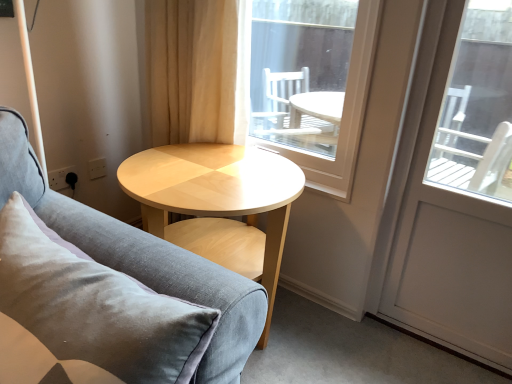
Question: Is beige fabric curtain at upper center shorter than transparent glass window at center?

Choices:
 (A) yes
 (B) no

Answer: (A)

Question: Is beige fabric curtain at upper center oriented away from transparent glass window at center?

Choices:
 (A) yes
 (B) no

Answer: (B)

Question: Can you confirm if beige fabric curtain at upper center is taller than transparent glass window at center?

Choices:
 (A) no
 (B) yes

Answer: (A)

Question: Are beige fabric curtain at upper center and transparent glass window at center making contact?

Choices:
 (A) no
 (B) yes

Answer: (A)

Question: Is beige fabric curtain at upper center smaller than transparent glass window at center?

Choices:
 (A) yes
 (B) no

Answer: (B)

Question: In the image, is beige fabric curtain at upper center on the left side or the right side of transparent glass window at center?

Choices:
 (A) right
 (B) left

Answer: (B)

Question: Considering their positions, is beige fabric curtain at upper center located in front of or behind transparent glass window at center?

Choices:
 (A) behind
 (B) front

Answer: (A)

Question: From their relative heights in the image, would you say beige fabric curtain at upper center is taller or shorter than transparent glass window at center?

Choices:
 (A) short
 (B) tall

Answer: (A)

Question: Considering the positions of point (182, 11) and point (301, 119), is point (182, 11) closer or farther from the camera than point (301, 119)?

Choices:
 (A) farther
 (B) closer

Answer: (B)

Question: Is point (471, 155) positioned closer to the camera than point (0, 172)?

Choices:
 (A) closer
 (B) farther

Answer: (B)

Question: In terms of height, does white glossy screen door at right look taller or shorter compared to velvet grey couch at center?

Choices:
 (A) short
 (B) tall

Answer: (B)

Question: Which is correct: white glossy screen door at right is inside velvet grey couch at center, or outside of it?

Choices:
 (A) inside
 (B) outside

Answer: (B)

Question: From the image's perspective, relative to velvet grey couch at center, is white glossy screen door at right above or below?

Choices:
 (A) above
 (B) below

Answer: (A)

Question: From the image's perspective, is velvet grey couch at center positioned above or below transparent glass window at center?

Choices:
 (A) above
 (B) below

Answer: (B)

Question: From a real-world perspective, is velvet grey couch at center above or below transparent glass window at center?

Choices:
 (A) below
 (B) above

Answer: (A)